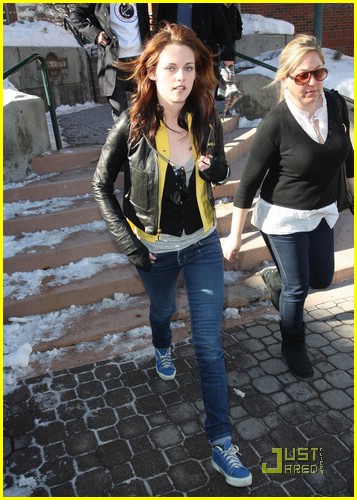
You are a GUI agent. You are given a task and a screenshot of the screen. Output one action in this format:
    pyautogui.click(x=<x>, y=<y>)
    Task: Click on the hand railing
    
    Given the screenshot: What is the action you would take?
    pyautogui.click(x=20, y=65), pyautogui.click(x=259, y=63)